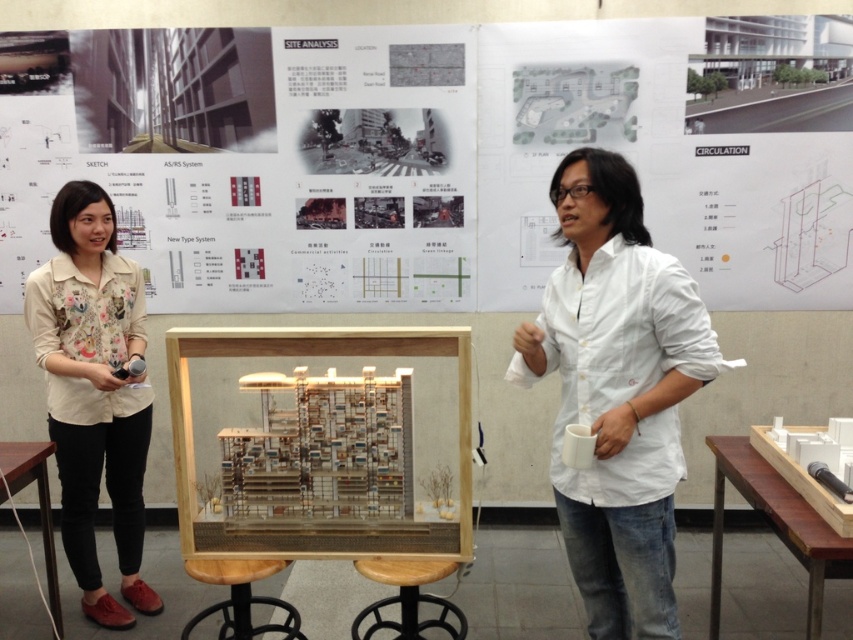
In the scene shown: Is white matte shirt at center smaller than transparent glass model at center?

Incorrect, white matte shirt at center is not smaller in size than transparent glass model at center.

Does white matte shirt at center have a lesser height compared to transparent glass model at center?

In fact, white matte shirt at center may be taller than transparent glass model at center.

You are a GUI agent. You are given a task and a screenshot of the screen. Output one action in this format:
    pyautogui.click(x=<x>, y=<y>)
    Task: Click on the white matte shirt at center
    
    Given the screenshot: What is the action you would take?
    pyautogui.click(x=618, y=392)

Can you confirm if white paper poster at upper center is smaller than transparent glass model at center?

No, white paper poster at upper center is not smaller than transparent glass model at center.

Is point (184, 120) in front of point (276, 461)?

No, it is not.

The height and width of the screenshot is (640, 853). Identify the location of white paper poster at upper center. (415, 161).

Based on the photo, can you confirm if transparent glass model at center is bigger than floral-patterned shirt at left?

Actually, transparent glass model at center might be smaller than floral-patterned shirt at left.

Does point (427, 348) lie behind point (82, 483)?

That is False.

The image size is (853, 640). What do you see at coordinates (320, 451) in the screenshot?
I see `transparent glass model at center` at bounding box center [320, 451].

Find the location of a particular element. The width and height of the screenshot is (853, 640). transparent glass model at center is located at coordinates (320, 451).